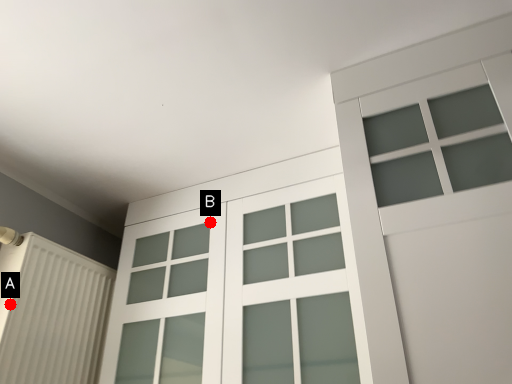
Question: Two points are circled on the image, labeled by A and B beside each circle. Which point is closer to the camera taking this photo?

Choices:
 (A) A is closer
 (B) B is closer

Answer: (A)